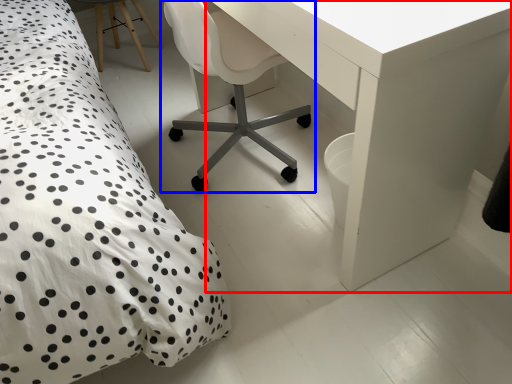
Question: Which object is further to the camera taking this photo, table (highlighted by a red box) or chair (highlighted by a blue box)?

Choices:
 (A) table
 (B) chair

Answer: (B)